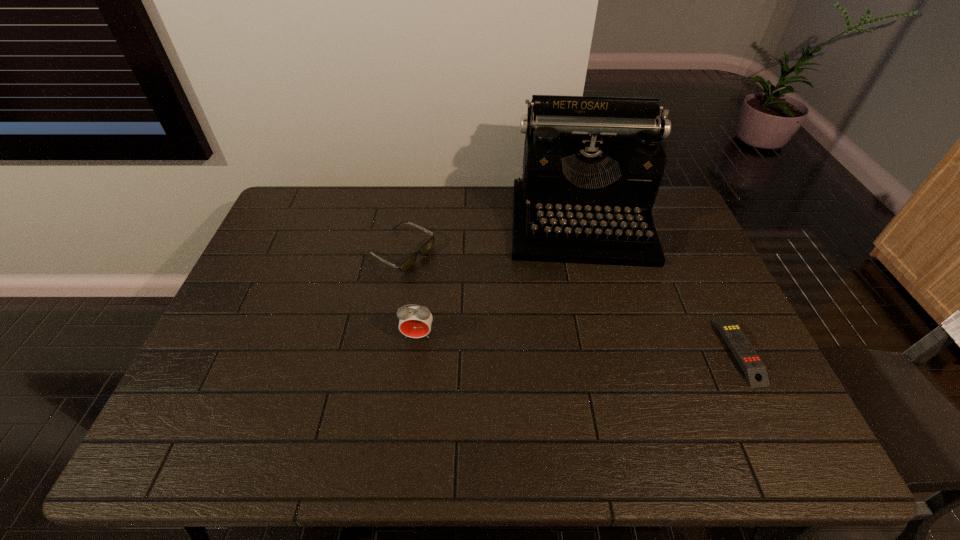
You are a GUI agent. You are given a task and a screenshot of the screen. Output one action in this format:
    pyautogui.click(x=<x>, y=<y>)
    Task: Click on the vacant space situated 0.090m on the front-facing side of the third tallest object
    
    Given the screenshot: What is the action you would take?
    pyautogui.click(x=450, y=278)

Identify the location of free space located 0.250m on the typing side of the typewriter. This screenshot has width=960, height=540. (596, 334).

At what (x,y) coordinates should I click in order to perform the action: click on vacant space positioned 0.260m on the typing side of the typewriter. Please return your answer as a coordinate pair (x, y). Looking at the image, I should click on click(596, 336).

Locate an element on the screen. This screenshot has height=540, width=960. free spot located on the typing side of the typewriter is located at coordinates (595, 328).

You are a GUI agent. You are given a task and a screenshot of the screen. Output one action in this format:
    pyautogui.click(x=<x>, y=<y>)
    Task: Click on the object located at the far edge
    
    Given the screenshot: What is the action you would take?
    pyautogui.click(x=592, y=167)

The height and width of the screenshot is (540, 960). What are the coordinates of `object present at the near edge` in the screenshot? It's located at (754, 369).

This screenshot has height=540, width=960. Find the location of `remote control that is at the right edge`. remote control that is at the right edge is located at coordinates (754, 369).

Locate an element on the screen. The height and width of the screenshot is (540, 960). typewriter positioned at the right edge is located at coordinates tap(592, 167).

Where is `object at the far right corner`? This screenshot has height=540, width=960. object at the far right corner is located at coordinates (592, 167).

The height and width of the screenshot is (540, 960). In order to click on object present at the near right corner in this screenshot , I will do [754, 369].